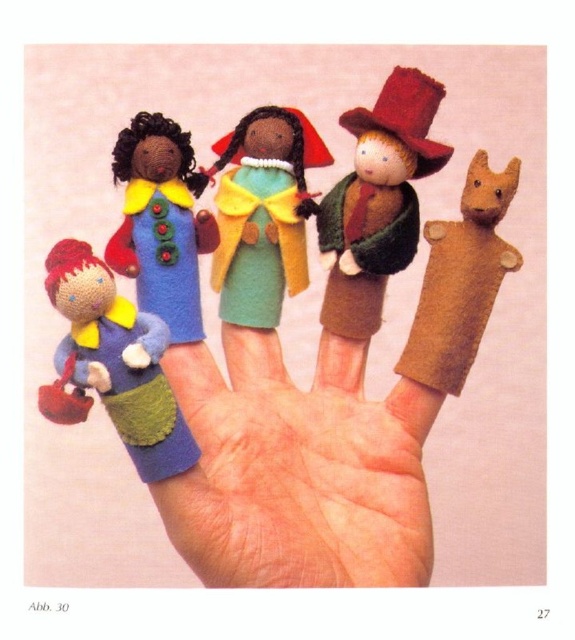
Looking at this image, which is below, blue felt finger puppet at center or brown felt dog at right?

blue felt finger puppet at center is below.

Between blue felt finger puppet at center and brown felt dog at right, which one is positioned higher?

brown felt dog at right is higher up.

Which is behind, point (310, 545) or point (480, 296)?

Positioned behind is point (480, 296).

The image size is (575, 640). I want to click on blue felt finger puppet at center, so click(x=297, y=470).

Is velvet brown hat at upper right wider than blue felt doll at center?

Indeed, velvet brown hat at upper right has a greater width compared to blue felt doll at center.

Describe the element at coordinates (377, 202) in the screenshot. The height and width of the screenshot is (640, 575). I see `velvet brown hat at upper right` at that location.

Between point (363, 316) and point (159, 115), which one is positioned in front?

Point (159, 115)

I want to click on velvet brown hat at upper right, so (377, 202).

Is matte blue felt doll at left taller than green felt doll at center?

Incorrect, matte blue felt doll at left's height is not larger of green felt doll at center's.

In the scene shown: Between matte blue felt doll at left and green felt doll at center, which one appears on the right side from the viewer's perspective?

green felt doll at center is more to the right.

Between point (98, 360) and point (224, 257), which one is positioned in front?

Positioned in front is point (98, 360).

Where is `matte blue felt doll at left`? The height and width of the screenshot is (640, 575). matte blue felt doll at left is located at coordinates (113, 364).